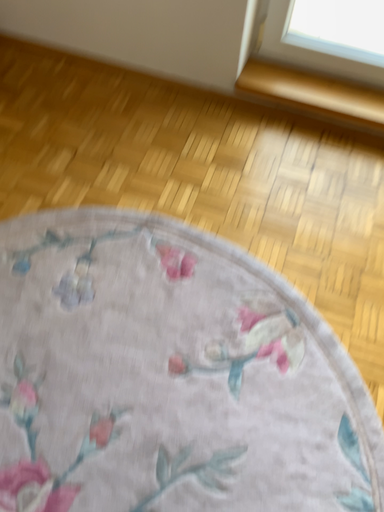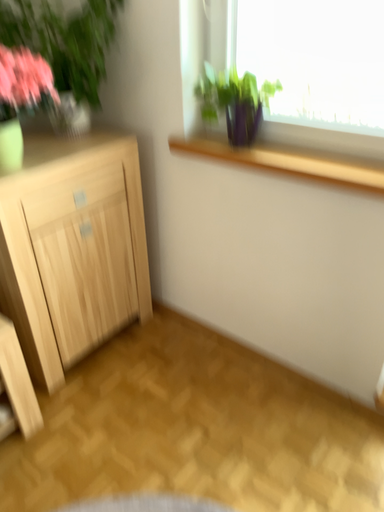
Question: Which way did the camera rotate in the video?

Choices:
 (A) rotated right
 (B) rotated left

Answer: (B)